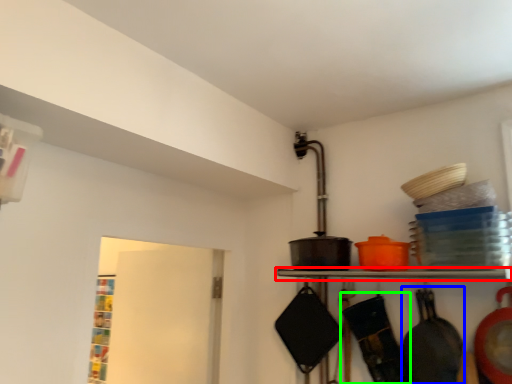
Question: Estimate the real-world distances between objects in this image. Which object is farther from shelf (highlighted by a red box), frying pan (highlighted by a blue box) or frying pan (highlighted by a green box)?

Choices:
 (A) frying pan
 (B) frying pan

Answer: (A)